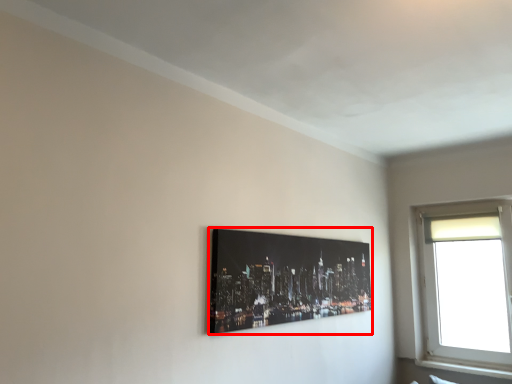
Question: From the image's perspective, what is the correct spatial positioning of picture frame (annotated by the red box) in reference to window?

Choices:
 (A) above
 (B) below

Answer: (A)